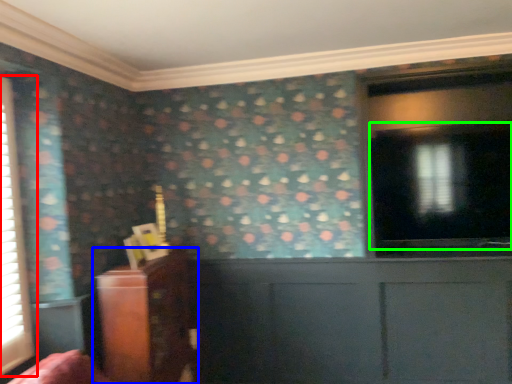
Question: Estimate the real-world distances between objects in this image. Which object is farther from window (highlighted by a red box), furniture (highlighted by a blue box) or window screen (highlighted by a green box)?

Choices:
 (A) furniture
 (B) window screen

Answer: (B)